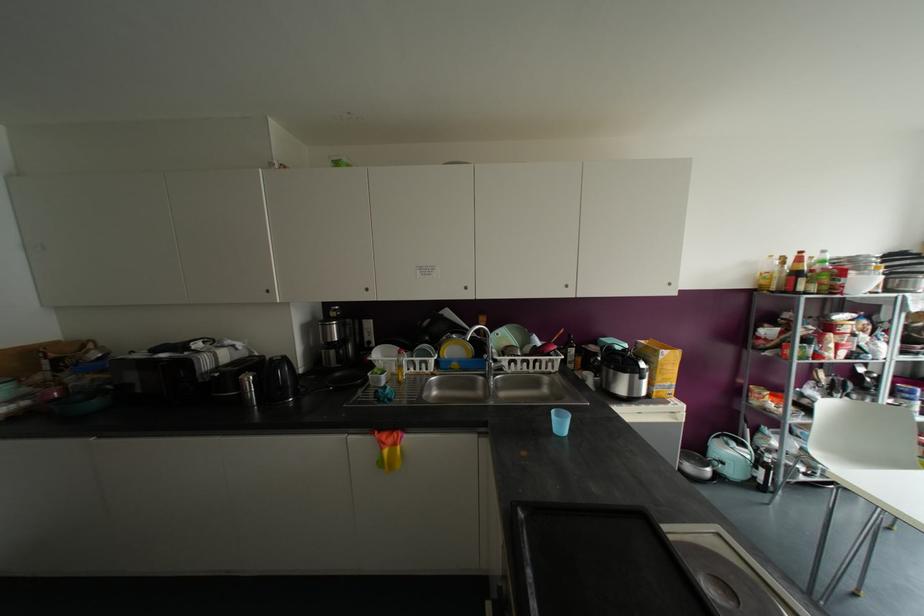
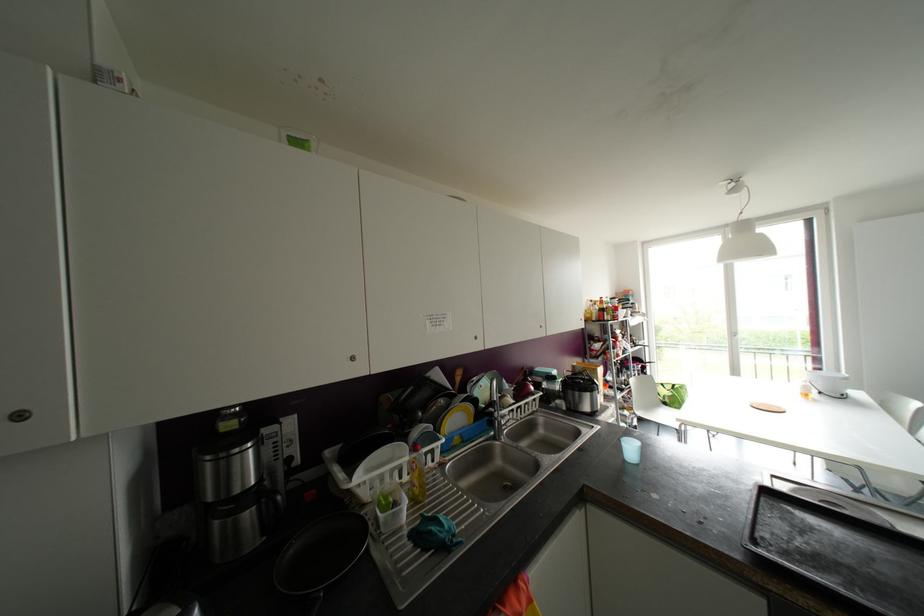
Locate, in the second image, the point that corresponds to the point at 489,363 in the first image.

(499, 422)